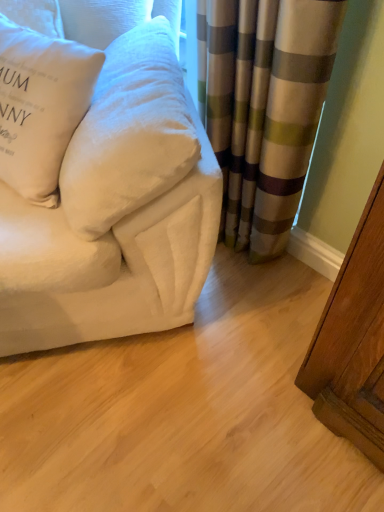
Question: Is white velvety pillow at left, which appears as the 1th pillow when viewed from the right, next to white soft pillow at upper left, which is the 1th pillow from left to right?

Choices:
 (A) yes
 (B) no

Answer: (B)

Question: Is white velvety pillow at left, which appears as the 1th pillow when viewed from the right, at the left side of white soft pillow at upper left, which is the 1th pillow from left to right?

Choices:
 (A) yes
 (B) no

Answer: (B)

Question: Is white velvety pillow at left, positioned as the 2th pillow in left-to-right order, located outside white soft pillow at upper left, marked as the 2th pillow in a right-to-left arrangement?

Choices:
 (A) yes
 (B) no

Answer: (A)

Question: Is white velvety pillow at left, positioned as the 2th pillow in left-to-right order, taller than white soft pillow at upper left, which is the 1th pillow from left to right?

Choices:
 (A) yes
 (B) no

Answer: (B)

Question: From the image's perspective, does white velvety pillow at left, positioned as the 2th pillow in left-to-right order, appear higher than white soft pillow at upper left, which is the 1th pillow from left to right?

Choices:
 (A) no
 (B) yes

Answer: (A)

Question: From a real-world perspective, is white velvety pillow at left, which appears as the 1th pillow when viewed from the right, positioned under white soft pillow at upper left, marked as the 2th pillow in a right-to-left arrangement, based on gravity?

Choices:
 (A) yes
 (B) no

Answer: (A)

Question: Considering the relative sizes of white velvety couch at upper left and white soft pillow at upper left, marked as the 2th pillow in a right-to-left arrangement, in the image provided, is white velvety couch at upper left thinner than white soft pillow at upper left, marked as the 2th pillow in a right-to-left arrangement,?

Choices:
 (A) no
 (B) yes

Answer: (A)

Question: Does white velvety couch at upper left have a greater height compared to white soft pillow at upper left, which is the 1th pillow from left to right?

Choices:
 (A) no
 (B) yes

Answer: (B)

Question: Does white velvety couch at upper left appear on the right side of white soft pillow at upper left, which is the 1th pillow from left to right?

Choices:
 (A) yes
 (B) no

Answer: (A)

Question: Considering the relative positions of white velvety couch at upper left and white soft pillow at upper left, marked as the 2th pillow in a right-to-left arrangement, in the image provided, is white velvety couch at upper left behind white soft pillow at upper left, marked as the 2th pillow in a right-to-left arrangement,?

Choices:
 (A) yes
 (B) no

Answer: (B)

Question: Does white velvety couch at upper left come in front of white soft pillow at upper left, marked as the 2th pillow in a right-to-left arrangement?

Choices:
 (A) no
 (B) yes

Answer: (B)

Question: Considering the relative sizes of white velvety couch at upper left and white soft pillow at upper left, marked as the 2th pillow in a right-to-left arrangement, in the image provided, is white velvety couch at upper left shorter than white soft pillow at upper left, marked as the 2th pillow in a right-to-left arrangement,?

Choices:
 (A) yes
 (B) no

Answer: (B)

Question: From the image's perspective, is striped fabric curtain at center beneath white velvety couch at upper left?

Choices:
 (A) yes
 (B) no

Answer: (A)